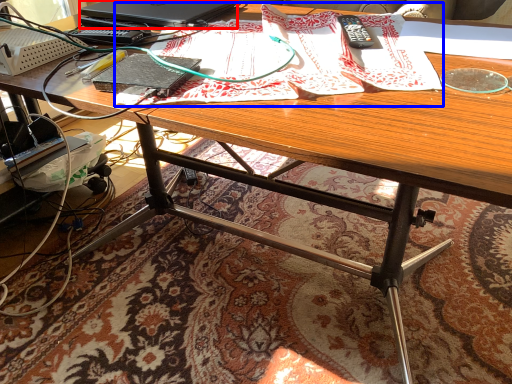
Question: Which object is closer to the camera taking this photo, laptop (highlighted by a red box) or wrapping paper (highlighted by a blue box)?

Choices:
 (A) laptop
 (B) wrapping paper

Answer: (B)